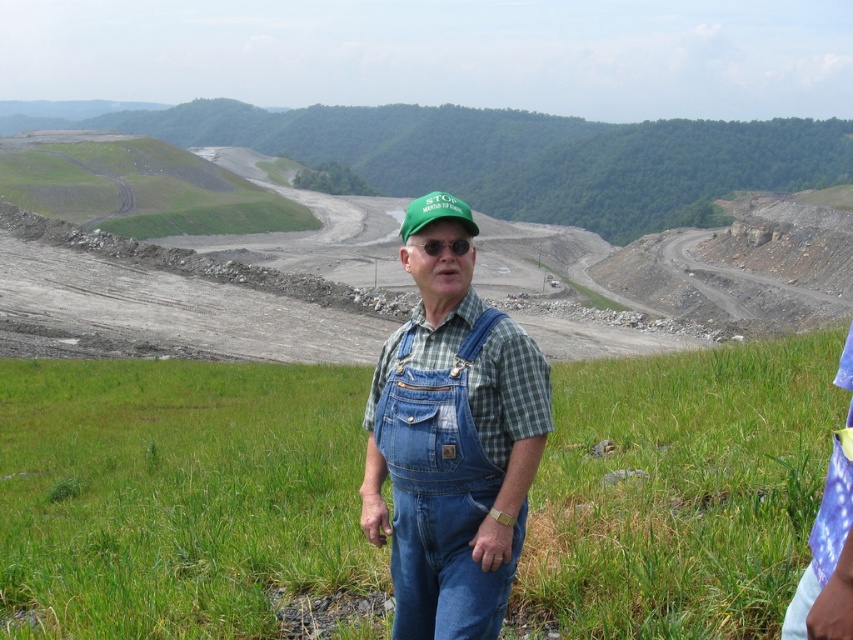
The man in the image is wearing two items on his head. The green fabric cap at center and the black plastic goggles at center. Which of these two items is bigger in size?

The green fabric cap at center is larger in size compared to the black plastic goggles at center.

Where is the denim overalls at center located in the image?

The denim overalls at center is located at point [451,452] in the image.

You are a safety inspector checking the equipment of workers on a construction site. You notice a worker wearing green grass at center and black plastic goggles at center. Which item is wider?

The green grass at center is wider than the black plastic goggles at center.